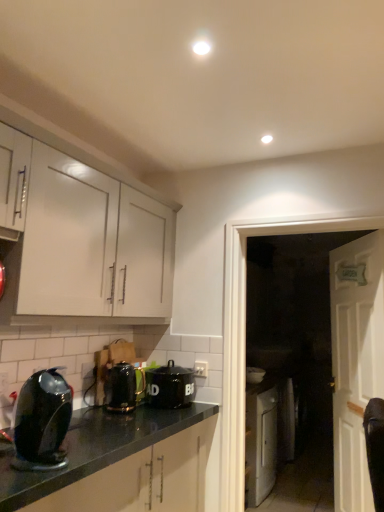
Question: Considering the relative sizes of white wooden door at right and white glossy cabinet at upper left in the image provided, is white wooden door at right shorter than white glossy cabinet at upper left?

Choices:
 (A) yes
 (B) no

Answer: (B)

Question: Is white wooden door at right taller than white glossy cabinet at upper left?

Choices:
 (A) yes
 (B) no

Answer: (A)

Question: Does white wooden door at right appear on the left side of white glossy cabinet at upper left?

Choices:
 (A) no
 (B) yes

Answer: (A)

Question: From the image's perspective, is white wooden door at right below white glossy cabinet at upper left?

Choices:
 (A) no
 (B) yes

Answer: (B)

Question: Are white wooden door at right and white glossy cabinet at upper left making contact?

Choices:
 (A) yes
 (B) no

Answer: (B)

Question: From the image's perspective, is metallic black kettle at lower center, the second kitchen appliance when ordered from back to front, positioned above or below white glossy door at right?

Choices:
 (A) above
 (B) below

Answer: (B)

Question: In the image, is metallic black kettle at lower center, the second kitchen appliance when ordered from back to front, on the left side or the right side of white glossy door at right?

Choices:
 (A) left
 (B) right

Answer: (A)

Question: Is metallic black kettle at lower center, positioned as the second kitchen appliance in right-to-left order, spatially inside white glossy door at right, or outside of it?

Choices:
 (A) outside
 (B) inside

Answer: (A)

Question: From a real-world perspective, is metallic black kettle at lower center, positioned as the second kitchen appliance in right-to-left order, above or below white glossy door at right?

Choices:
 (A) above
 (B) below

Answer: (B)

Question: Considering the relative positions of white wooden door at right and shiny black kettle at lower left, acting as the 1th kitchen appliance starting from the left, in the image provided, is white wooden door at right to the left or to the right of shiny black kettle at lower left, acting as the 1th kitchen appliance starting from the left,?

Choices:
 (A) right
 (B) left

Answer: (A)

Question: In terms of height, does white wooden door at right look taller or shorter compared to shiny black kettle at lower left, which ranks as the first kitchen appliance in front-to-back order?

Choices:
 (A) short
 (B) tall

Answer: (B)

Question: From the image's perspective, is white wooden door at right above or below shiny black kettle at lower left, the third kitchen appliance when ordered from back to front?

Choices:
 (A) above
 (B) below

Answer: (B)

Question: Is white wooden door at right in front of or behind shiny black kettle at lower left, acting as the 1th kitchen appliance starting from the left, in the image?

Choices:
 (A) behind
 (B) front

Answer: (A)

Question: Is shiny black kettle at lower left, the third kitchen appliance when ordered from back to front, wider or thinner than white glossy door at right?

Choices:
 (A) thin
 (B) wide

Answer: (B)

Question: From the image's perspective, is shiny black kettle at lower left, positioned as the 3th kitchen appliance in right-to-left order, positioned above or below white glossy door at right?

Choices:
 (A) below
 (B) above

Answer: (B)